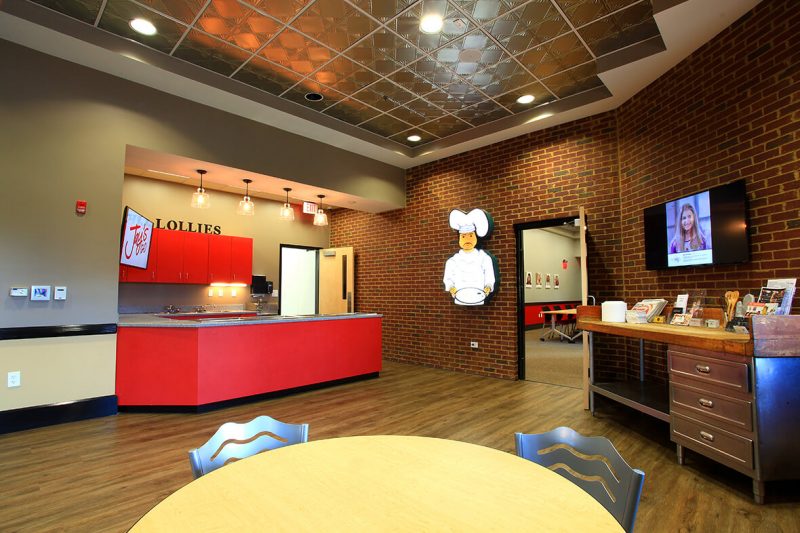
What are the coordinates of `ceiling` in the screenshot? It's located at (476, 83).